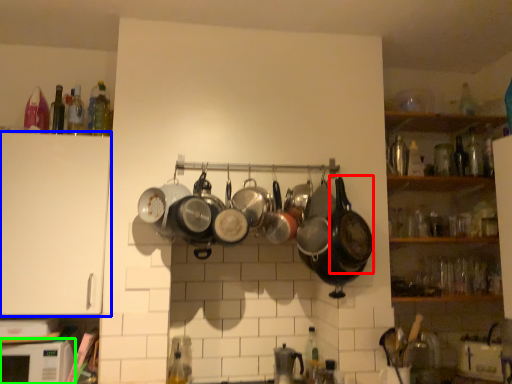
Question: Based on their relative distances, which object is farther from wok (highlighted by a red box)? Choose from cabinetry (highlighted by a blue box) and microwave (highlighted by a green box).

Choices:
 (A) cabinetry
 (B) microwave

Answer: (B)